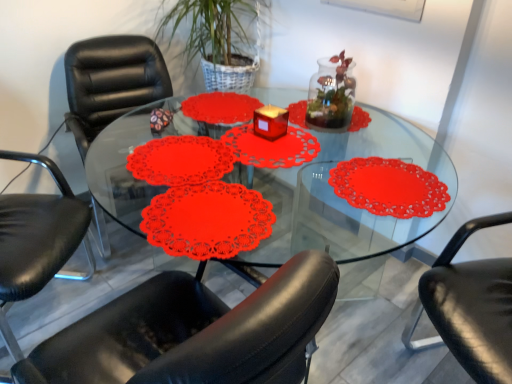
Locate an element on the screen. The image size is (512, 384). free point behind matte red candle at center is located at coordinates (268, 116).